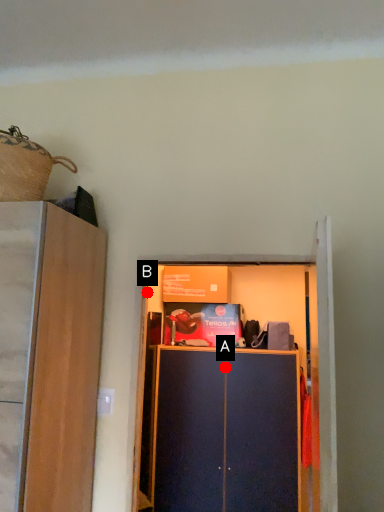
Question: Two points are circled on the image, labeled by A and B beside each circle. Which point is further to the camera?

Choices:
 (A) A is further
 (B) B is further

Answer: (A)